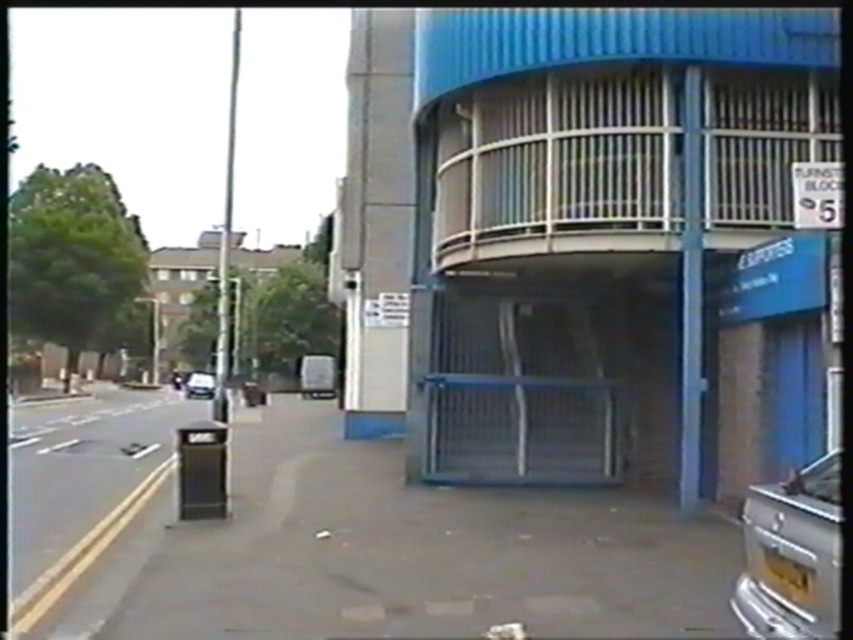
Which is behind, point (749, 509) or point (210, 394)?

Point (210, 394)

Find the location of a particular element. Image resolution: width=853 pixels, height=640 pixels. shiny silver car at lower right is located at coordinates (792, 554).

Find the location of a particular element. shiny silver car at lower right is located at coordinates (792, 554).

Is smooth concrete pavement at center below shiny silver car at center?

No.

The image size is (853, 640). Identify the location of smooth concrete pavement at center. (x=334, y=538).

You are a GUI agent. You are given a task and a screenshot of the screen. Output one action in this format:
    pyautogui.click(x=<x>, y=<y>)
    Task: Click on the smooth concrete pavement at center
    
    Given the screenshot: What is the action you would take?
    pyautogui.click(x=334, y=538)

Does smooth concrete pavement at center have a greater height compared to shiny silver car at lower right?

Yes, smooth concrete pavement at center is taller than shiny silver car at lower right.

Which is behind, point (296, 564) or point (786, 529)?

The point (296, 564) is more distant.

Looking at this image, who is more distant from viewer, (498, 566) or (743, 586)?

Point (498, 566)

Where is `smooth concrete pavement at center`? The height and width of the screenshot is (640, 853). smooth concrete pavement at center is located at coordinates (334, 538).